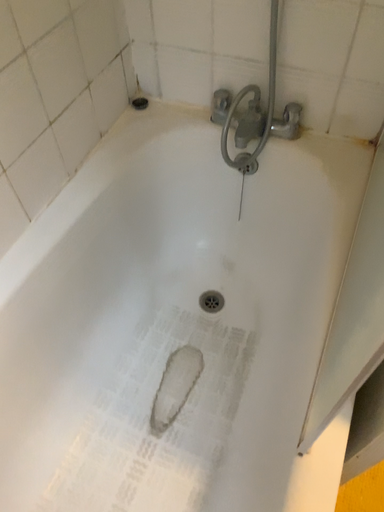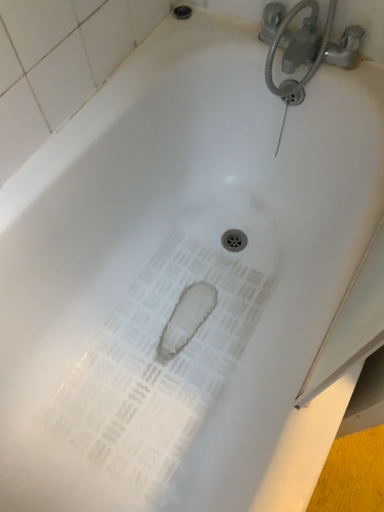
Question: How did the camera likely rotate when shooting the video?

Choices:
 (A) rotated downward
 (B) rotated upward

Answer: (A)